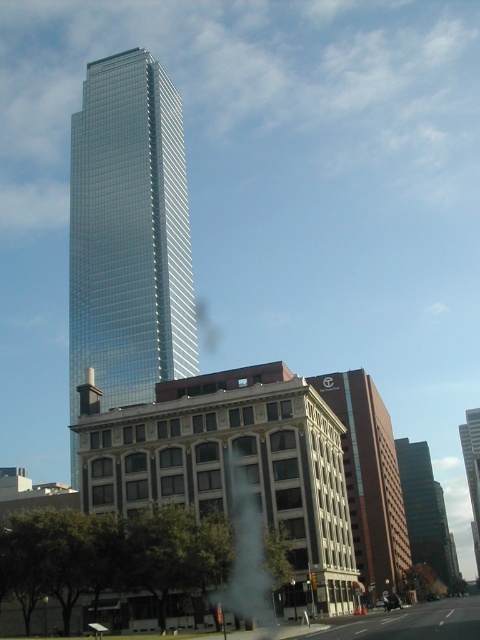
Question: Can you confirm if brown brick building at center is positioned to the left of dark glass skyscraper at center?

Choices:
 (A) yes
 (B) no

Answer: (A)

Question: Which point is closer to the camera?

Choices:
 (A) dark glass skyscraper at center
 (B) shiny glass skyscraper at center
 (C) brown brick building at center

Answer: (C)

Question: Which of the following is the farthest from the observer?

Choices:
 (A) (360, 520)
 (B) (409, 524)
 (C) (477, 564)
 (D) (124, 346)

Answer: (C)

Question: Is dark glass skyscraper at center wider than glassy reflective skyscraper at center?

Choices:
 (A) no
 (B) yes

Answer: (A)

Question: Is brown brick building at center smaller than dark glass skyscraper at center?

Choices:
 (A) no
 (B) yes

Answer: (B)

Question: Which of the following is the closest to the observer?

Choices:
 (A) (383, 566)
 (B) (469, 492)
 (C) (412, 509)
 (D) (96, 260)

Answer: (A)